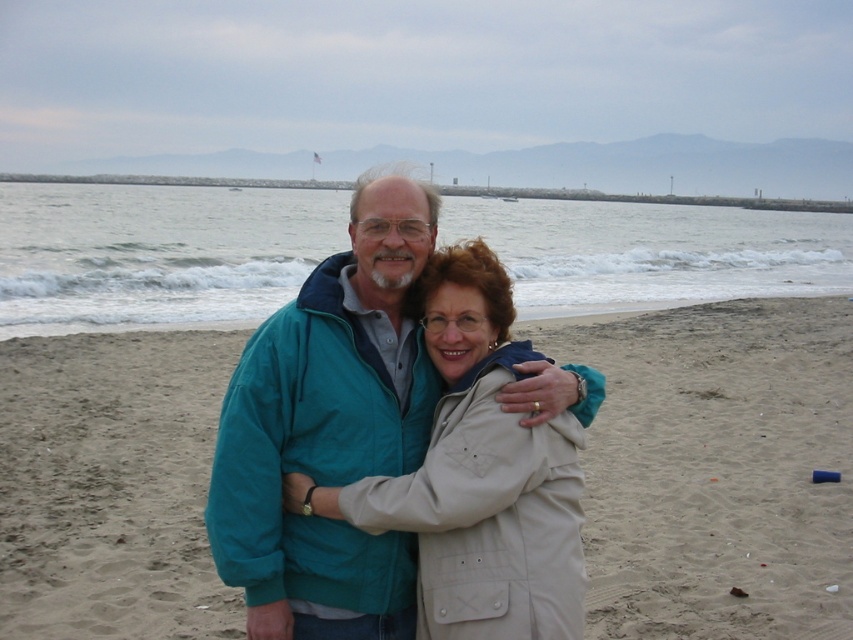
Question: Estimate the real-world distances between objects in this image. Which object is farther from the clear water at center?

Choices:
 (A) beige sand at center
 (B) beige fabric jacket at center

Answer: (B)

Question: Which point is farther to the camera?

Choices:
 (A) (171, 186)
 (B) (38, 548)

Answer: (A)

Question: From the image, what is the correct spatial relationship of beige sand at center in relation to beige fabric jacket at center?

Choices:
 (A) left
 (B) right

Answer: (A)

Question: Is beige sand at center bigger than beige fabric jacket at center?

Choices:
 (A) yes
 (B) no

Answer: (A)

Question: Which of the following is the closest to the observer?

Choices:
 (A) (173, 307)
 (B) (819, 496)

Answer: (B)

Question: Can you confirm if beige sand at center is positioned to the left of beige fabric jacket at center?

Choices:
 (A) yes
 (B) no

Answer: (A)